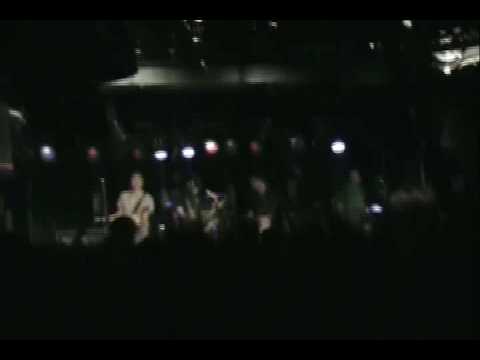
The image size is (480, 360). Find the location of `light`. light is located at coordinates (377, 208).